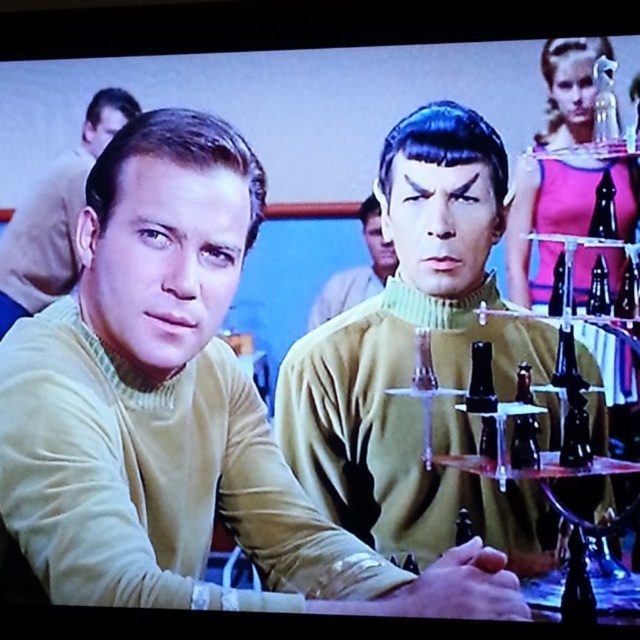
Question: Among these objects, which one is farthest from the camera?

Choices:
 (A) matte black bottle at center
 (B) black glass bottle at right

Answer: (A)

Question: Among these objects, which one is nearest to the camera?

Choices:
 (A) pink fabric dress at upper right
 (B) matte yellow sweater at center
 (C) clear glass bottle at right
 (D) green turtleneck sweater at center

Answer: (A)

Question: Estimate the real-world distances between objects in this image. Which object is closer to the matte yellow sweater at center?

Choices:
 (A) transparent plastic wine glass at right
 (B) clear glass bottle at center
 (C) clear glass bottle at right
 (D) matte black bottle at center

Answer: (A)

Question: From the image, what is the correct spatial relationship of pink fabric dress at upper right in relation to translucent glass bottle at right?

Choices:
 (A) left
 (B) right

Answer: (B)

Question: Can you confirm if transparent plastic wine glass at right is positioned to the right of matte black bottle at center?

Choices:
 (A) no
 (B) yes

Answer: (B)

Question: Does pink fabric dress at upper right appear under matte yellow sweater at left?

Choices:
 (A) no
 (B) yes

Answer: (A)